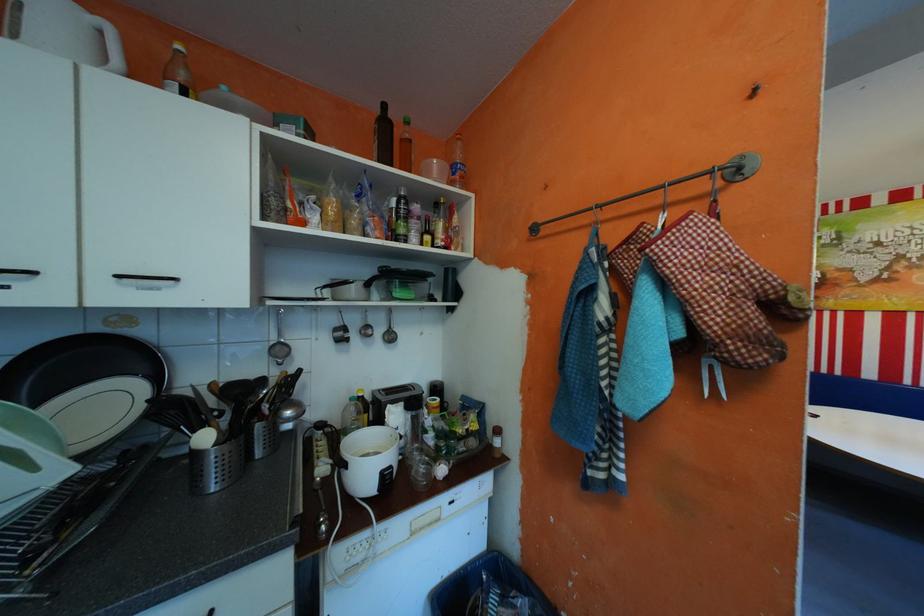
This screenshot has width=924, height=616. What do you see at coordinates (392, 400) in the screenshot?
I see `a toaster lever` at bounding box center [392, 400].